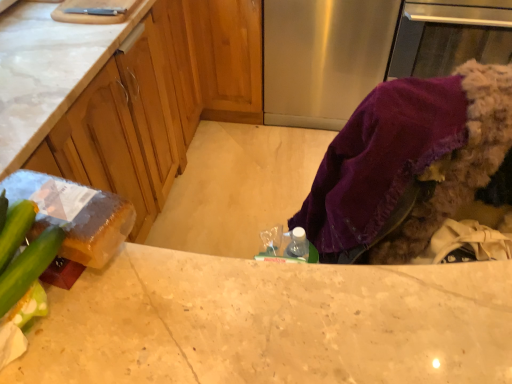
Question: Is green matte cucumber at lower left to the right of marble countertop at center from the viewer's perspective?

Choices:
 (A) no
 (B) yes

Answer: (A)

Question: Are green matte cucumber at lower left and marble countertop at center far apart?

Choices:
 (A) yes
 (B) no

Answer: (B)

Question: From the image's perspective, would you say green matte cucumber at lower left is shown under marble countertop at center?

Choices:
 (A) no
 (B) yes

Answer: (A)

Question: Is green matte cucumber at lower left positioned beyond the bounds of marble countertop at center?

Choices:
 (A) yes
 (B) no

Answer: (A)

Question: Can you confirm if green matte cucumber at lower left is wider than marble countertop at center?

Choices:
 (A) no
 (B) yes

Answer: (A)

Question: Looking at their shapes, would you say matte wood cabinets at center is wider or thinner than green matte cucumber at lower left?

Choices:
 (A) wide
 (B) thin

Answer: (A)

Question: Is matte wood cabinets at center inside the boundaries of green matte cucumber at lower left, or outside?

Choices:
 (A) inside
 (B) outside

Answer: (B)

Question: From the image's perspective, is matte wood cabinets at center above or below green matte cucumber at lower left?

Choices:
 (A) below
 (B) above

Answer: (B)

Question: From a real-world perspective, is matte wood cabinets at center above or below green matte cucumber at lower left?

Choices:
 (A) above
 (B) below

Answer: (B)

Question: In terms of height, does green matte cucumber at lower left look taller or shorter compared to marble countertop at center?

Choices:
 (A) tall
 (B) short

Answer: (B)

Question: Considering the positions of point (26, 286) and point (128, 322), is point (26, 286) closer or farther from the camera than point (128, 322)?

Choices:
 (A) closer
 (B) farther

Answer: (A)

Question: Is green matte cucumber at lower left in front of or behind marble countertop at center in the image?

Choices:
 (A) behind
 (B) front

Answer: (B)

Question: From a real-world perspective, is green matte cucumber at lower left positioned above or below marble countertop at center?

Choices:
 (A) above
 (B) below

Answer: (A)

Question: In terms of size, does purple fabric at lower right appear bigger or smaller than marble countertop at center?

Choices:
 (A) big
 (B) small

Answer: (B)

Question: From a real-world perspective, is purple fabric at lower right positioned above or below marble countertop at center?

Choices:
 (A) above
 (B) below

Answer: (A)